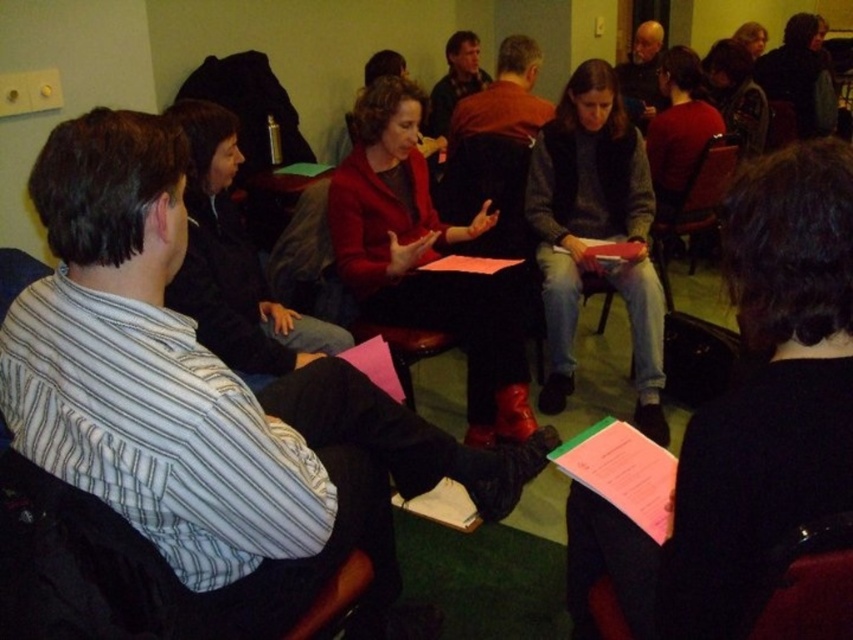
You are organizing a photo shoot and need to place a small microphone stand between the matte black jacket at center and the knit gray sweater at center. According to the scene description, where should you position the microphone stand relative to the two items?

The matte black jacket at center is positioned on the left side of knit gray sweater at center, so the microphone stand should be placed between them, to the right of the matte black jacket at center and to the left of the knit gray sweater at center.

You are attending a meeting and notice a matte red coat at center. If you want to place a small bag on the floor next to it, where should you position the bag relative to the coat?

The matte red coat at center is located at point coordinates (424, 259). To place the small bag next to it on the floor, position the bag near the same coordinates but slightly lower to account for the floor level.